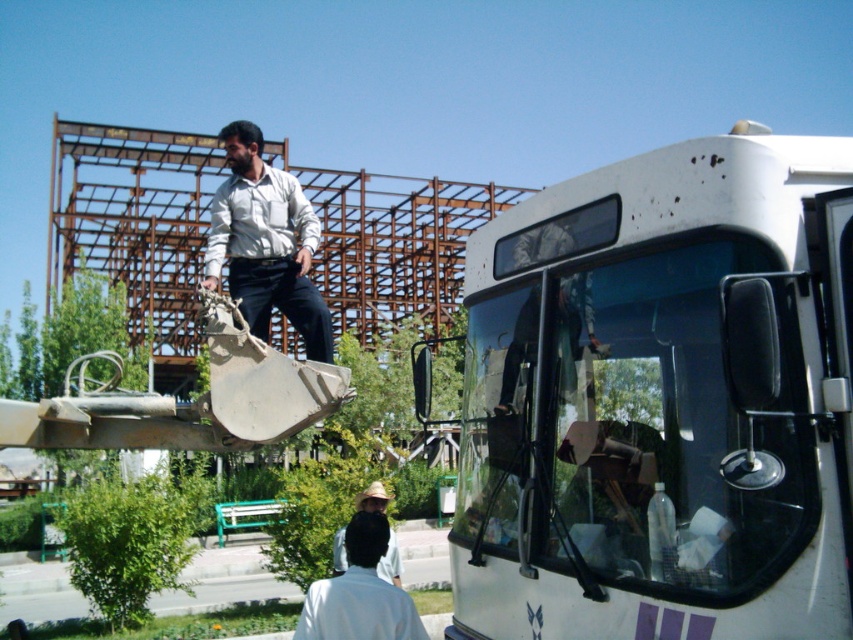
Question: Considering the relative positions of white matte bus at center and white matte shirt at lower center in the image provided, where is white matte bus at center located with respect to white matte shirt at lower center?

Choices:
 (A) below
 (B) above

Answer: (B)

Question: Estimate the real-world distances between objects in this image. Which object is closer to the white shirt at upper center?

Choices:
 (A) white matte bus at center
 (B) white matte shirt at lower center

Answer: (B)

Question: Which object is closer to the camera taking this photo?

Choices:
 (A) white matte shirt at lower center
 (B) white matte bus at center

Answer: (B)

Question: Observing the image, what is the correct spatial positioning of white shirt at upper center in reference to white matte shirt at lower center?

Choices:
 (A) right
 (B) left

Answer: (B)

Question: Observing the image, what is the correct spatial positioning of white matte bus at center in reference to white matte shirt at lower center?

Choices:
 (A) left
 (B) right

Answer: (B)

Question: Which object is closer to the camera taking this photo?

Choices:
 (A) white matte bus at center
 (B) white matte shirt at lower center
 (C) white shirt at upper center

Answer: (A)